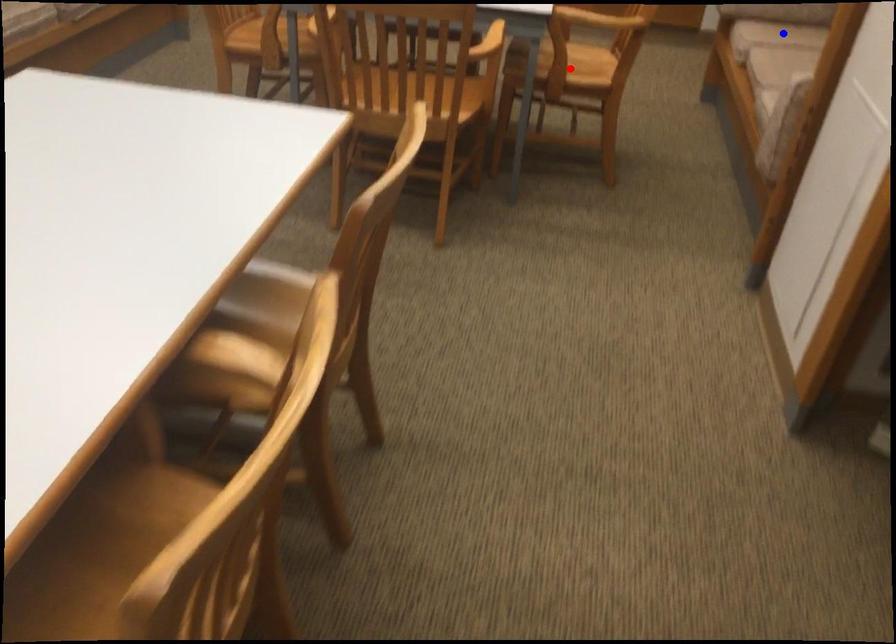
Question: Which of the two points in the image is closer to the camera?

Choices:
 (A) Blue point is closer.
 (B) Red point is closer.

Answer: (A)